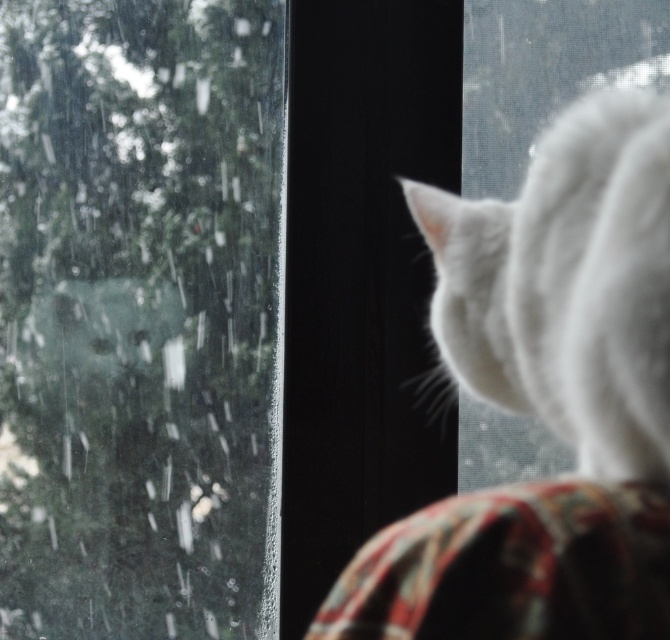
You are a photographer trying to capture the white fluffy cat at upper right and the transparent glass window at upper left in the same frame. Which object takes up more space in the image?

The white fluffy cat at upper right occupies more space in the image than the transparent glass window at upper left, as the transparent glass window at upper left is described to occupy less space.

You are a photographer trying to capture the white fluffy cat at upper right through the transparent glass window at upper left. Can you see the cat clearly through the window?

The white fluffy cat at upper right is behind the transparent glass window at upper left, so yes, you can see the cat clearly through the window as the glass is transparent.

Based on the scene description, where is the transparent glass window at upper left located in the image?

The transparent glass window at upper left is located at point (135, 312) in the image.